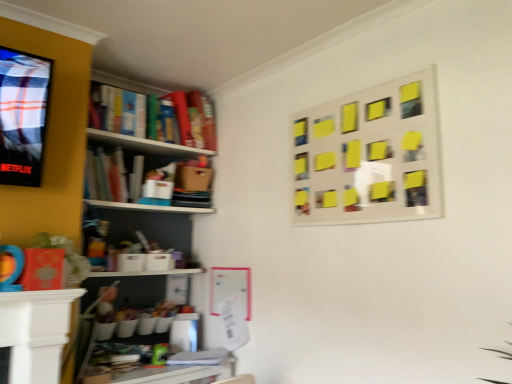
Question: Considering the relative positions of wooden desk at lower center, which is the 1th table in bottom-to-top order, and yellow sticky notes at upper right in the image provided, is wooden desk at lower center, which is the 1th table in bottom-to-top order, to the left of yellow sticky notes at upper right from the viewer's perspective?

Choices:
 (A) no
 (B) yes

Answer: (B)

Question: Does wooden desk at lower center, positioned as the 2th table in front-to-back order, come behind yellow sticky notes at upper right?

Choices:
 (A) yes
 (B) no

Answer: (A)

Question: Does wooden desk at lower center, placed as the 2th table when sorted from top to bottom, have a larger size compared to yellow sticky notes at upper right?

Choices:
 (A) no
 (B) yes

Answer: (B)

Question: Can you confirm if wooden desk at lower center, placed as the 2th table when sorted from top to bottom, is taller than yellow sticky notes at upper right?

Choices:
 (A) no
 (B) yes

Answer: (A)

Question: Is wooden desk at lower center, which is the 1th table in bottom-to-top order, far away from yellow sticky notes at upper right?

Choices:
 (A) yes
 (B) no

Answer: (A)

Question: Is yellow sticky notes at upper right bigger or smaller than wooden desk at lower center, the 1th table viewed from the back?

Choices:
 (A) big
 (B) small

Answer: (B)

Question: Is yellow sticky notes at upper right in front of or behind wooden desk at lower center, placed as the 2th table when sorted from top to bottom, in the image?

Choices:
 (A) front
 (B) behind

Answer: (A)

Question: Is yellow sticky notes at upper right to the left or to the right of wooden desk at lower center, the 1th table viewed from the back, in the image?

Choices:
 (A) left
 (B) right

Answer: (B)

Question: Considering the positions of point (311, 220) and point (156, 369), is point (311, 220) closer or farther from the camera than point (156, 369)?

Choices:
 (A) farther
 (B) closer

Answer: (B)

Question: Is wooden desk at lower center, placed as the 2th table when sorted from top to bottom, spatially inside yellow sticky notes at upper right, or outside of it?

Choices:
 (A) outside
 (B) inside

Answer: (A)

Question: Looking at the image, does wooden desk at lower center, which is the 1th table in bottom-to-top order, seem bigger or smaller compared to yellow sticky notes at upper right?

Choices:
 (A) big
 (B) small

Answer: (A)

Question: In the image, is wooden desk at lower center, the 1th table viewed from the back, positioned in front of or behind yellow sticky notes at upper right?

Choices:
 (A) front
 (B) behind

Answer: (B)

Question: From the image's perspective, is wooden desk at lower center, positioned as the 2th table in front-to-back order, positioned above or below yellow sticky notes at upper right?

Choices:
 (A) below
 (B) above

Answer: (A)

Question: Would you say wooden desk at lower center, the 1th table viewed from the back, is to the left or to the right of white glossy table at lower left, which ranks as the second table in back-to-front order, in the picture?

Choices:
 (A) left
 (B) right

Answer: (B)

Question: From a real-world perspective, is wooden desk at lower center, placed as the 2th table when sorted from top to bottom, positioned above or below white glossy table at lower left, acting as the 2th table starting from the bottom?

Choices:
 (A) above
 (B) below

Answer: (B)